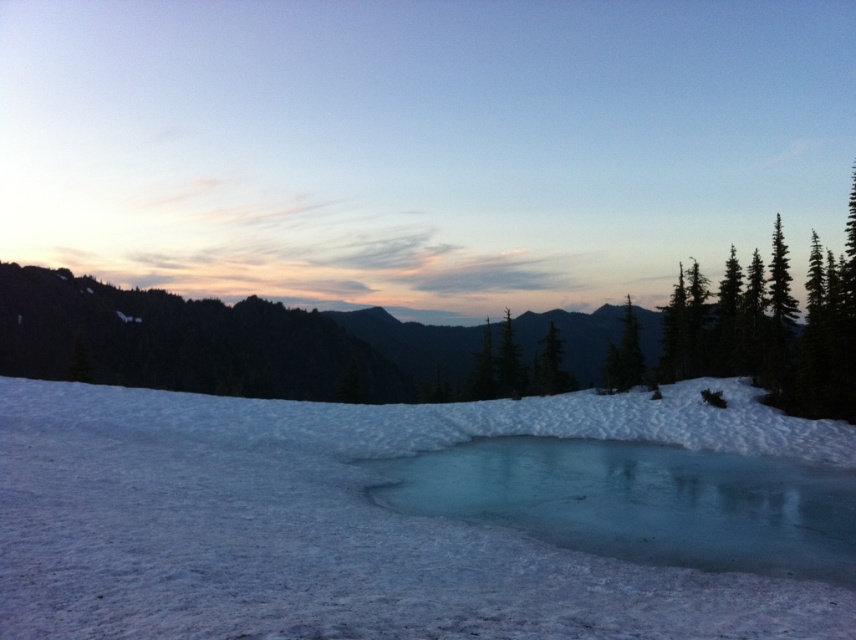
Question: Which object is the closest to the translucent ice at center?

Choices:
 (A) green matte tree at center
 (B) white snow at center

Answer: (B)

Question: Which is farther from the translucent ice at center?

Choices:
 (A) white snow at center
 (B) green matte tree at center

Answer: (B)

Question: Can you confirm if white snow at center is wider than green matte tree at center?

Choices:
 (A) no
 (B) yes

Answer: (B)

Question: Which object appears closest to the camera in this image?

Choices:
 (A) white snow at center
 (B) translucent ice at center

Answer: (A)

Question: From the image, what is the correct spatial relationship of white snow at center in relation to translucent ice at center?

Choices:
 (A) above
 (B) below

Answer: (A)

Question: Is white snow at center bigger than translucent ice at center?

Choices:
 (A) no
 (B) yes

Answer: (B)